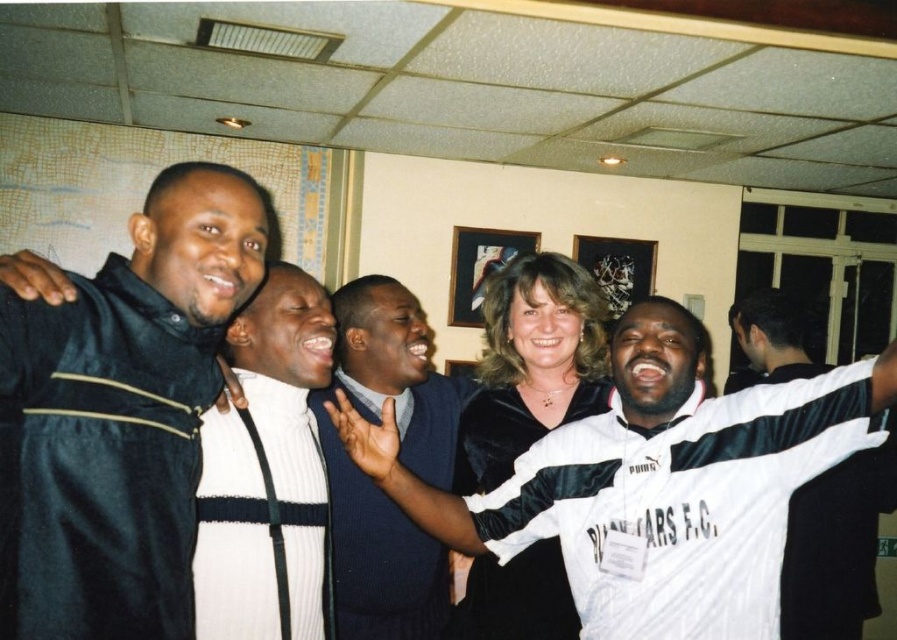
Where is the velvet black dress at center located in terms of coordinates?

The velvet black dress at center is located at coordinates point (536, 228).

You are standing at the origin of the coordinate system in the room. You see two points marked in the image, point 1 at coordinates point (405, 595) and point 2 at coordinates point (752, 352). Which point is closer to you?

Point 1 at coordinates point (405, 595) is closer to you because it is in front of point 2 at coordinates point (752, 352).